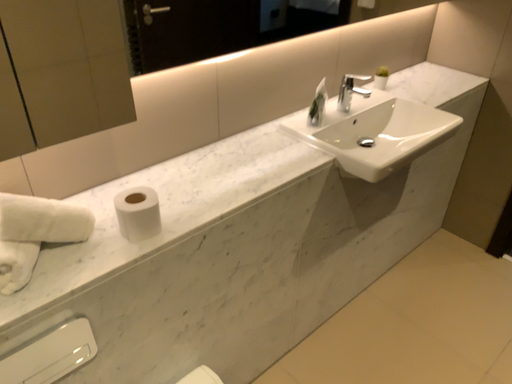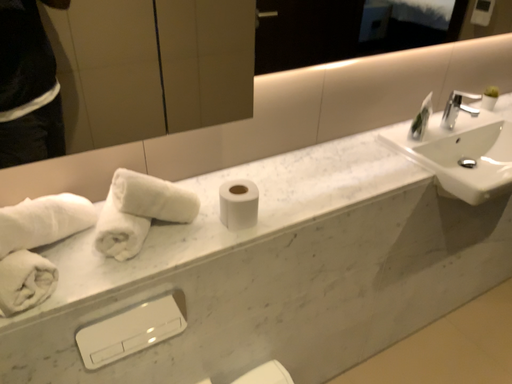
Question: Which way did the camera rotate in the video?

Choices:
 (A) rotated left
 (B) rotated right

Answer: (A)